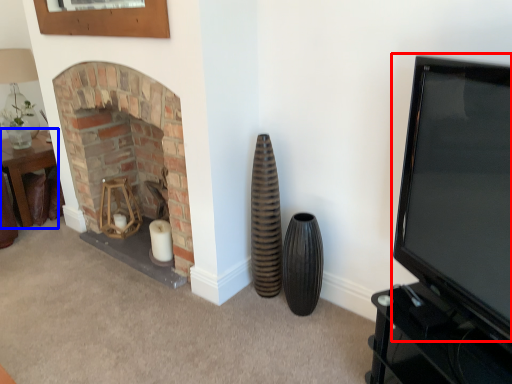
Question: Which of the following is the farthest to the observer, television (highlighted by a red box) or table (highlighted by a blue box)?

Choices:
 (A) television
 (B) table

Answer: (B)